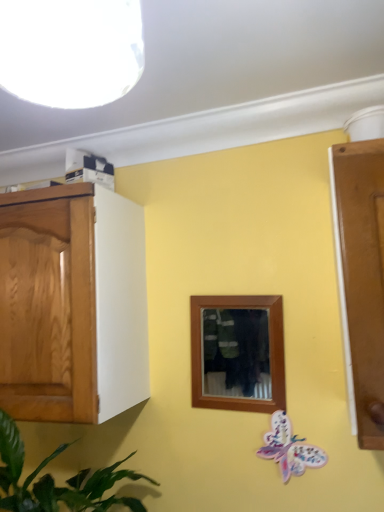
Question: Is white glossy light fixture at upper left wider or thinner than green leafy plant at left?

Choices:
 (A) thin
 (B) wide

Answer: (A)

Question: From their relative heights in the image, would you say white glossy light fixture at upper left is taller or shorter than green leafy plant at left?

Choices:
 (A) short
 (B) tall

Answer: (A)

Question: Which is nearer to the pastel paper butterfly at lower right?

Choices:
 (A) white glossy light fixture at upper left
 (B) green leafy plant at left

Answer: (B)

Question: Based on their relative distances, which object is farther from the green leafy plant at left?

Choices:
 (A) pastel paper butterfly at lower right
 (B) white glossy light fixture at upper left

Answer: (B)